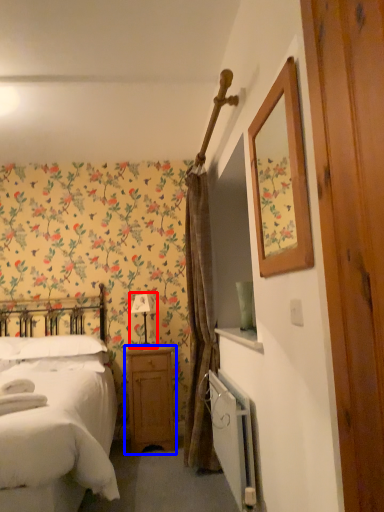
Question: Which object appears farthest to the camera in this image, table lamp (highlighted by a red box) or nightstand (highlighted by a blue box)?

Choices:
 (A) table lamp
 (B) nightstand

Answer: (A)